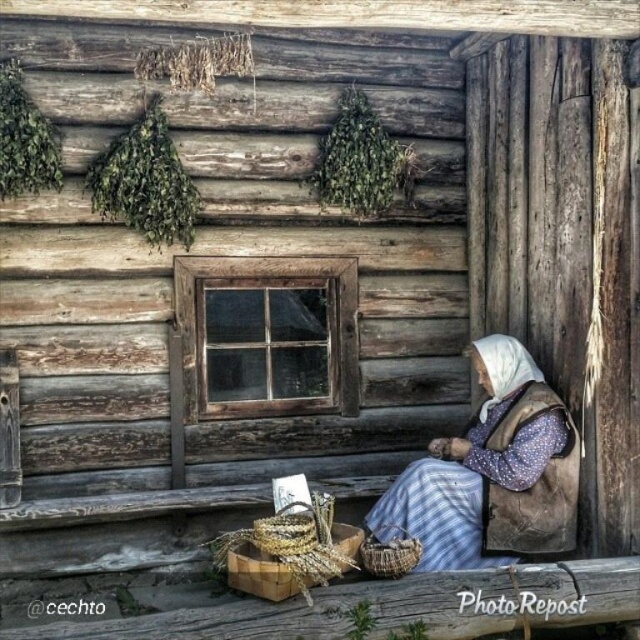
You are standing in front of the wooden cabin and notice the blue plaid dress at lower right and the natural woven basket at lower center. Which object is closer to you?

The blue plaid dress at lower right is closer to you than the natural woven basket at lower center.